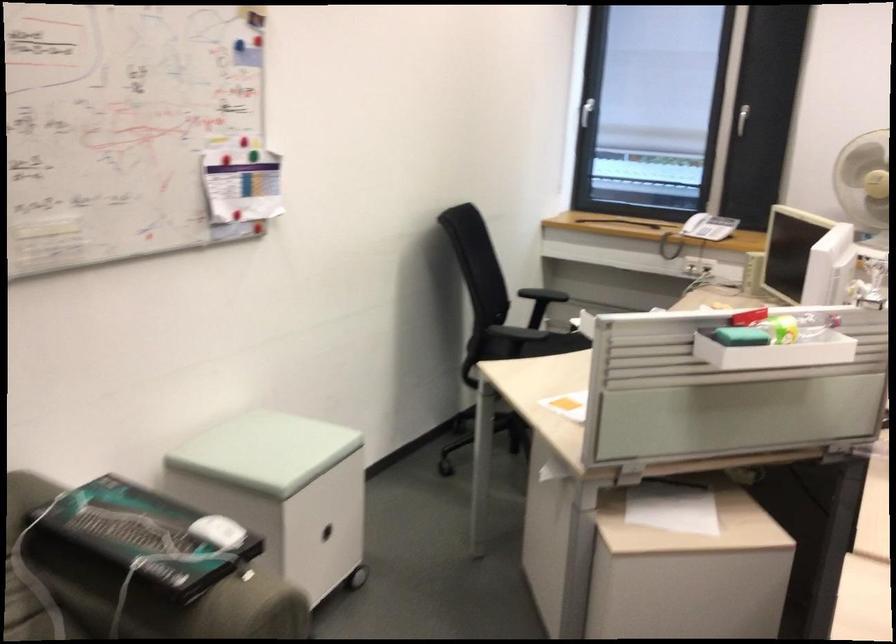
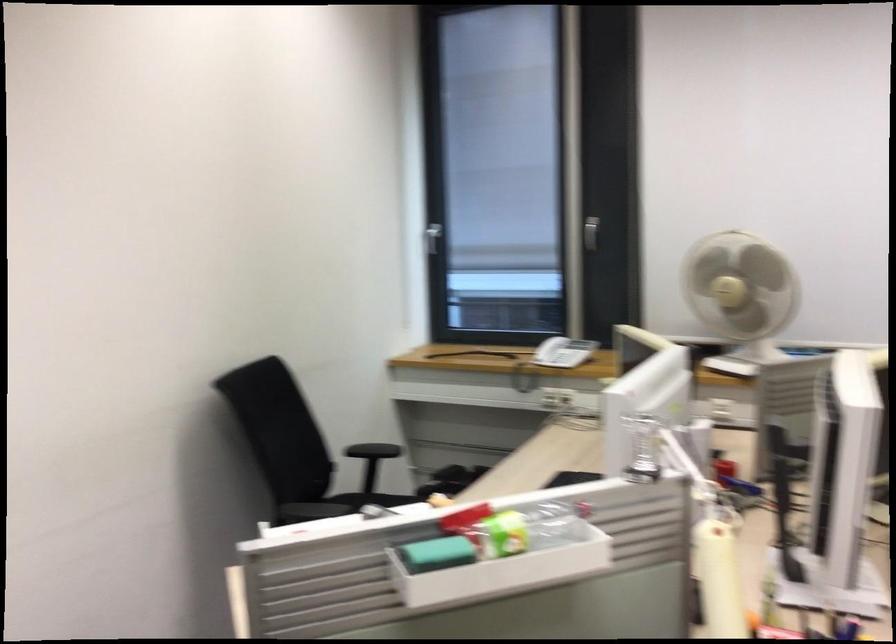
Locate, in the second image, the point that corresponds to (739,328) in the first image.

(436, 554)